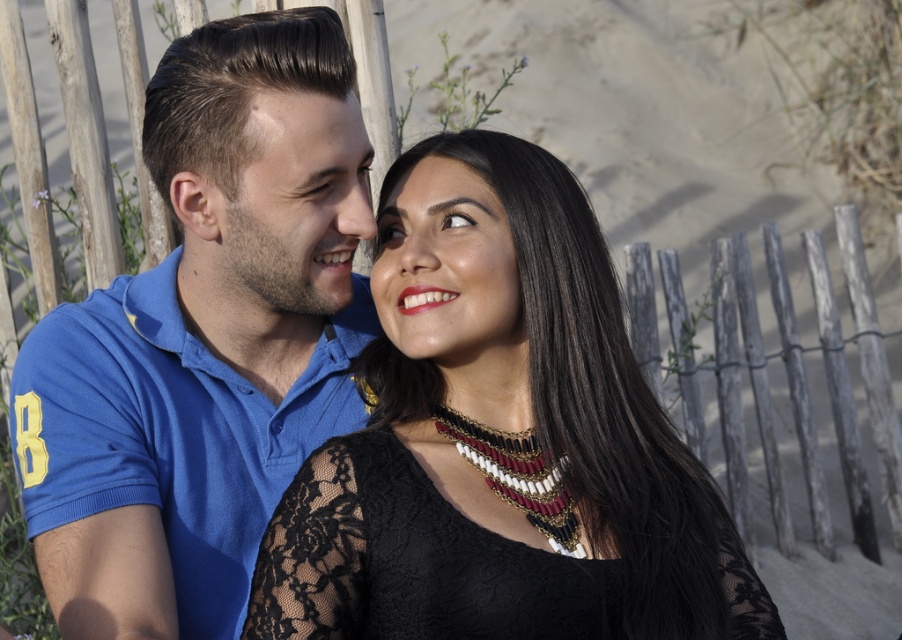
Who is positioned more to the right, black lace dress at center or matte black hair at upper center?

Positioned to the right is black lace dress at center.

Can you confirm if black lace dress at center is taller than matte black hair at upper center?

Yes.

Does point (388, 317) come behind point (279, 122)?

Yes, point (388, 317) is behind point (279, 122).

You are a GUI agent. You are given a task and a screenshot of the screen. Output one action in this format:
    pyautogui.click(x=<x>, y=<y>)
    Task: Click on the black lace dress at center
    This screenshot has width=902, height=640.
    Given the screenshot: What is the action you would take?
    pyautogui.click(x=502, y=442)

Between blue cotton polo shirt at left and matte black hair at upper center, which one has less height?

matte black hair at upper center

Is the position of blue cotton polo shirt at left less distant than that of matte black hair at upper center?

Yes, it is in front of matte black hair at upper center.

This screenshot has width=902, height=640. Describe the element at coordinates (198, 352) in the screenshot. I see `blue cotton polo shirt at left` at that location.

Where is `blue cotton polo shirt at left`? The width and height of the screenshot is (902, 640). blue cotton polo shirt at left is located at coordinates (198, 352).

Does black lace dress at center appear under blue cotton polo shirt at left?

Yes, black lace dress at center is below blue cotton polo shirt at left.

Between black lace dress at center and blue cotton polo shirt at left, which one is positioned higher?

blue cotton polo shirt at left is higher up.

Between point (422, 202) and point (300, 68), which one is positioned behind?

The point (422, 202) is more distant.

The width and height of the screenshot is (902, 640). What are the coordinates of `black lace dress at center` in the screenshot? It's located at (502, 442).